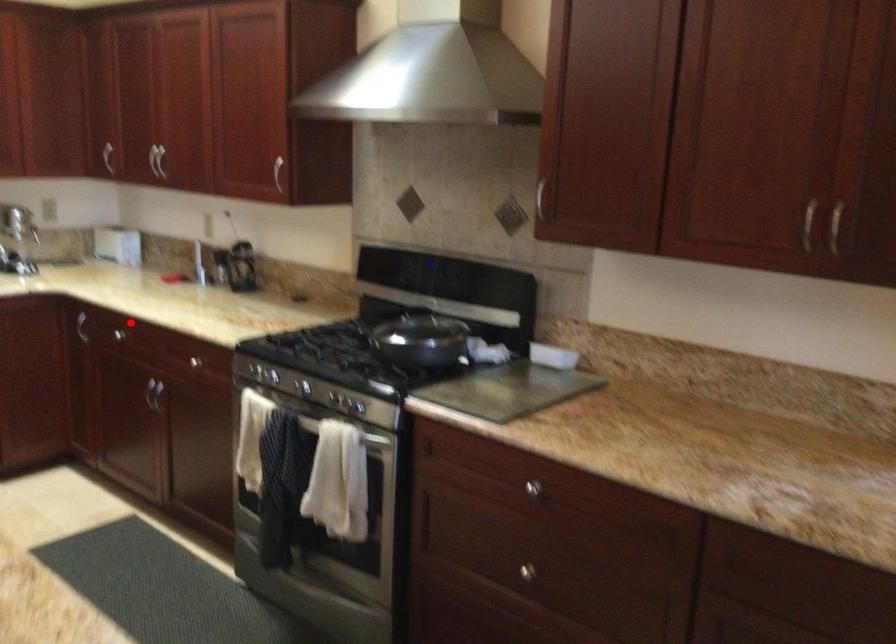
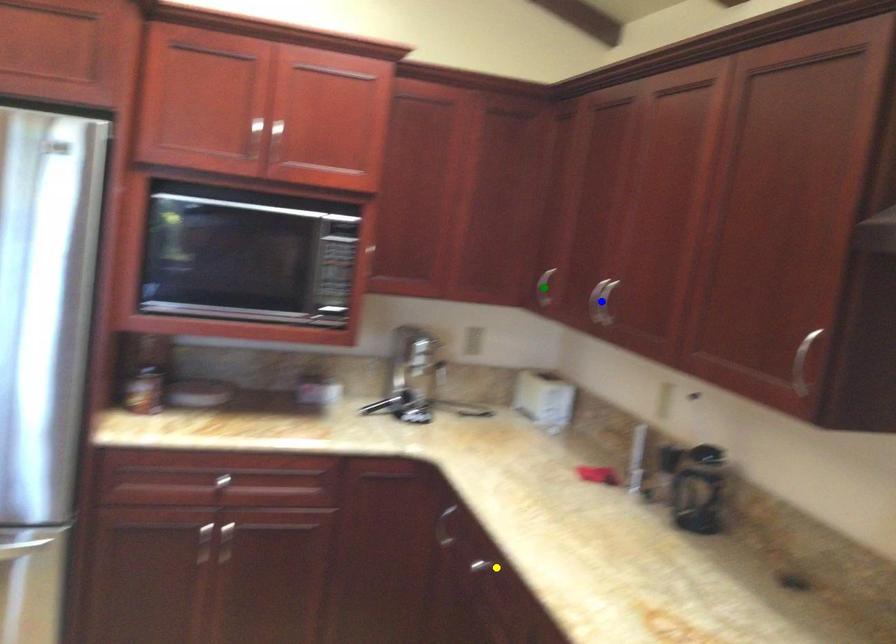
Question: I am providing you with two images of the same scene from different viewpoints. A red point is marked on the first image. You are given multiple points on the second image. Can you choose the point in image 2 that corresponds to the point in image 1?

Choices:
 (A) blue point
 (B) green point
 (C) yellow point

Answer: (C)